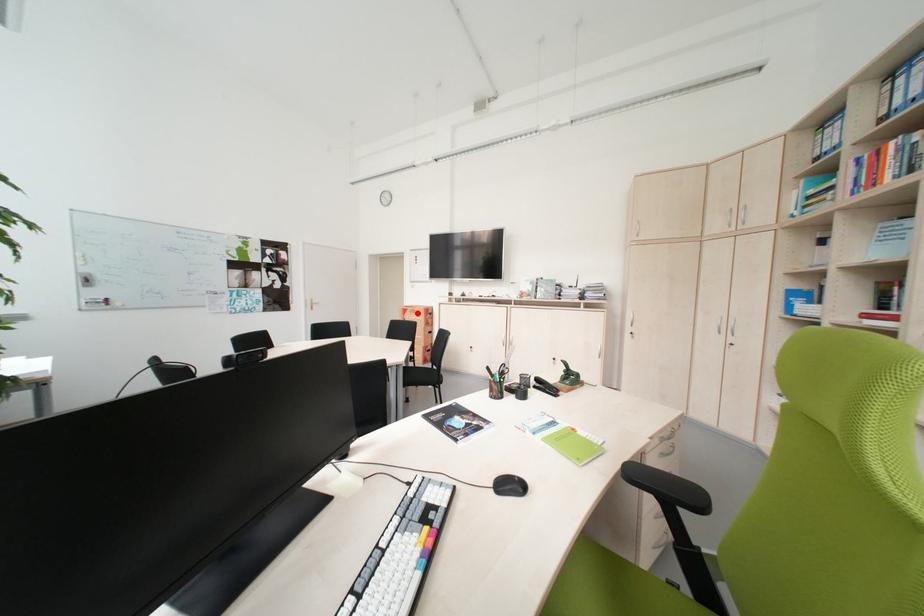
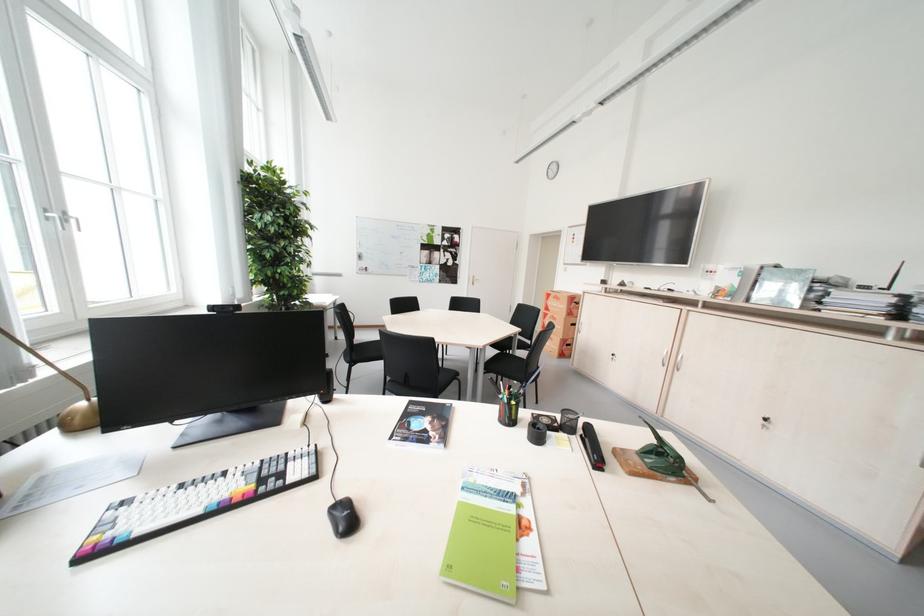
Where in the second image is the point corresponding to the highlighted location from the first image?

(561, 299)